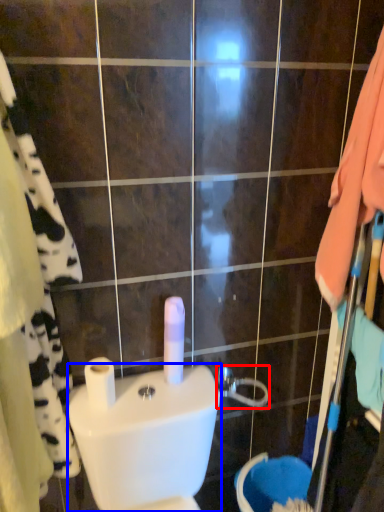
Question: Which point is further to the camera, shower (highlighted by a red box) or toilet bowl (highlighted by a blue box)?

Choices:
 (A) shower
 (B) toilet bowl

Answer: (A)